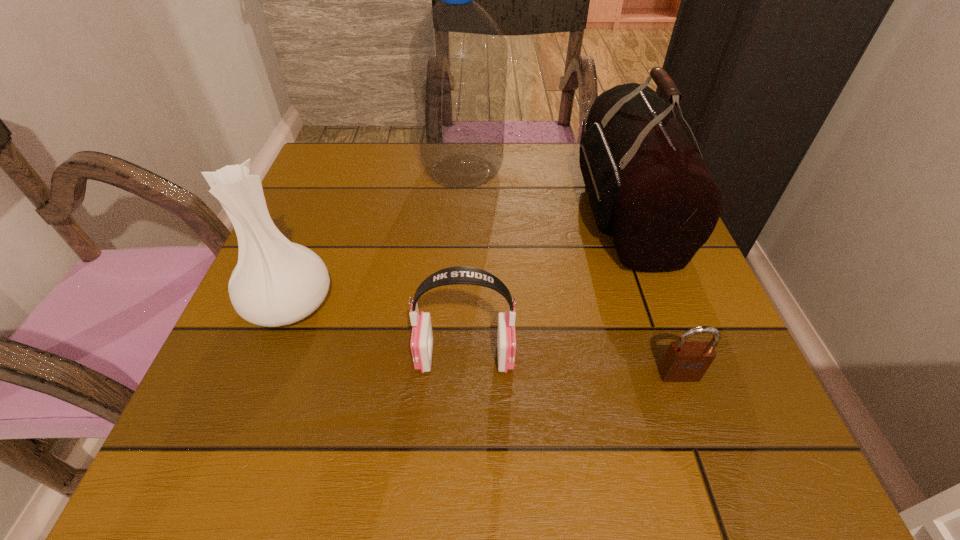
Locate an element on the screen. Image resolution: width=960 pixels, height=540 pixels. free spot located 0.110m on the outer surface of the earphone is located at coordinates (582, 357).

This screenshot has width=960, height=540. Identify the location of free space located on the front-facing side of the shortest object. (712, 469).

This screenshot has width=960, height=540. I want to click on water jug at the far edge, so click(x=458, y=54).

You are a GUI agent. You are given a task and a screenshot of the screen. Output one action in this format:
    pyautogui.click(x=<x>, y=<y>)
    Task: Click on the duffel bag that is positioned at the far edge
    The height and width of the screenshot is (540, 960).
    Given the screenshot: What is the action you would take?
    pyautogui.click(x=649, y=189)

Where is `object present at the left edge`? Image resolution: width=960 pixels, height=540 pixels. object present at the left edge is located at coordinates (276, 282).

Image resolution: width=960 pixels, height=540 pixels. I want to click on duffel bag that is at the right edge, so click(x=649, y=189).

This screenshot has width=960, height=540. What are the coordinates of `padlock that is at the right edge` in the screenshot? It's located at (684, 361).

Locate an element on the screen. Image resolution: width=960 pixels, height=540 pixels. object situated at the far right corner is located at coordinates (649, 189).

Find the location of `vacant space at the far edge of the desktop`. vacant space at the far edge of the desktop is located at coordinates pos(380,178).

This screenshot has width=960, height=540. Identify the location of vacant area at the near edge. (464, 455).